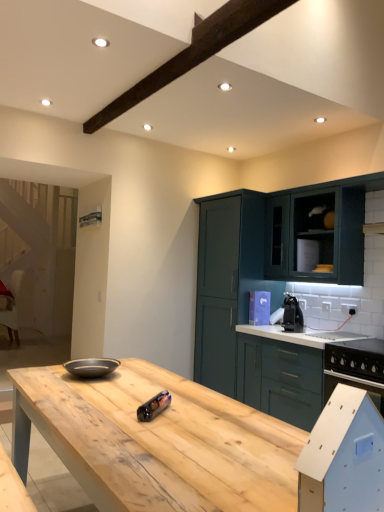
Identify the location of vacant space in front of black plastic coffee machine at center, the 1th appliance positioned from the right. This screenshot has height=512, width=384. (304, 333).